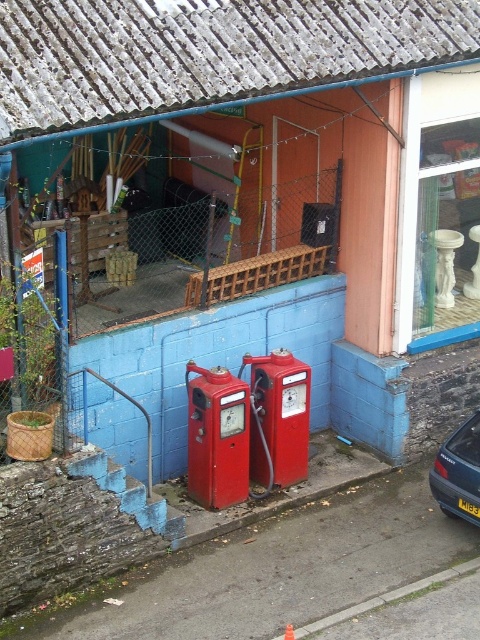
You are standing in front of the blue wall with two vintage red gas pumps. There are two points marked on the ground in front of you. The first point is at coordinates point (478,499) and the second is at point (475,516). Which point is closer to the blue wall?

Point (478,499) is in front of point (475,516), so it is closer to the blue wall.

You are a parking attendant who needs to check the license plate of the blue metallic car at lower right. Since the car is parked in front of the blue wall with vintage gas pumps, can you see the black plastic license plate at lower center from your current position?

The blue metallic car at lower right is located above the black plastic license plate at lower center, so the license plate is positioned lower and might be obscured by the car. Therefore, you might not be able to see the black plastic license plate at lower center from your current position.